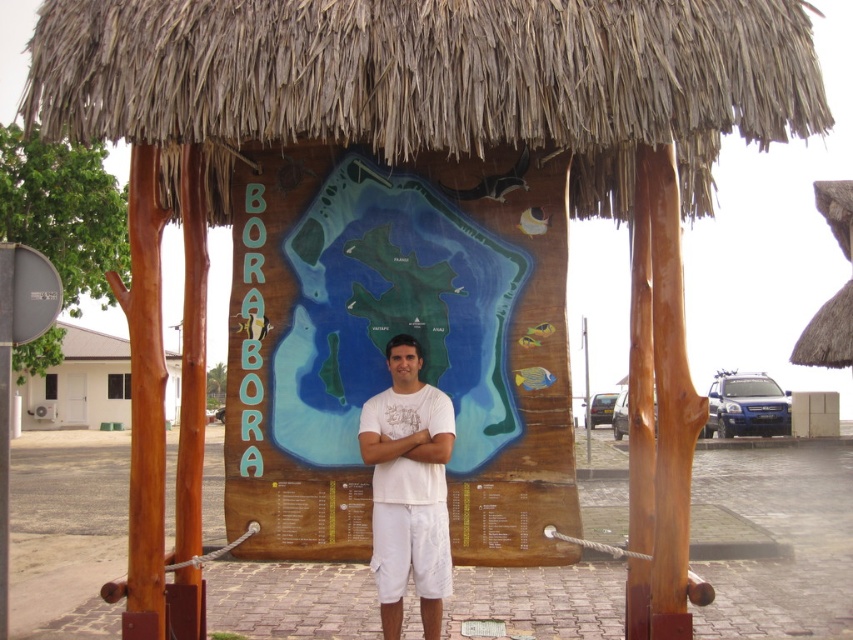
You are standing in front of the wooden structure and notice the white wood house at left and the white fabric at center. Which object is positioned lower from the ground?

The white wood house at left is positioned lower from the ground than the white fabric at center because it is below it.

You are standing in front of the wooden structure and notice the brown thatch at upper center and the white wood house at left. Which object is taller?

The white wood house at left is taller than the brown thatch at upper center.